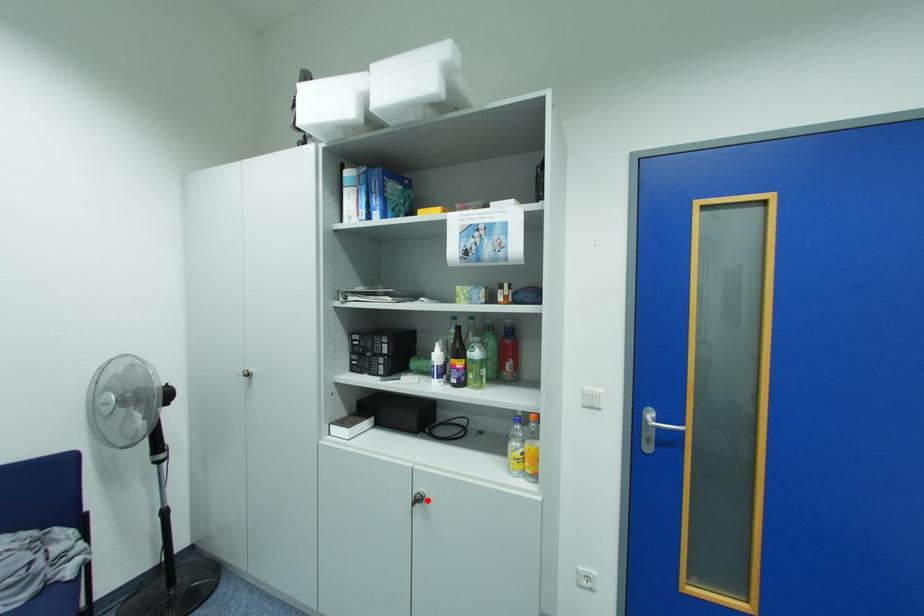
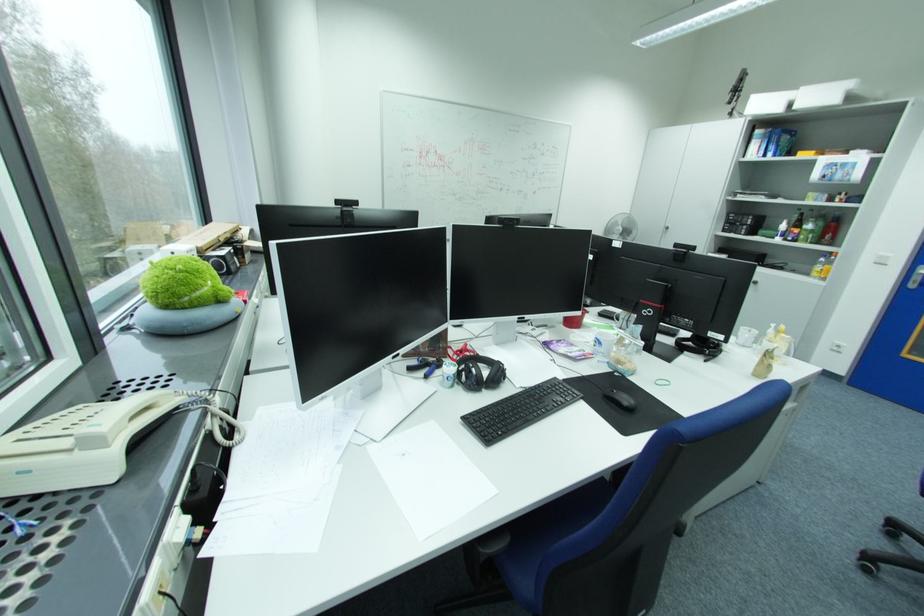
In the second image, find the point that corresponds to the highlighted location in the first image.

(763, 283)